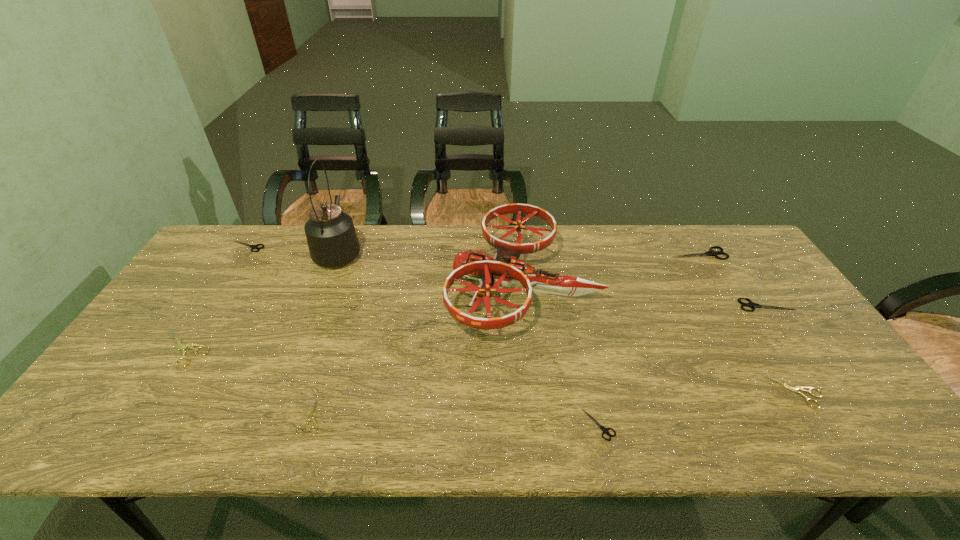
Find the location of `vacant space located on the left of the second smallest beige shears`. vacant space located on the left of the second smallest beige shears is located at coordinates (677, 392).

Where is `blank area located 0.290m on the right of the nearest black shears`? blank area located 0.290m on the right of the nearest black shears is located at coordinates (744, 424).

Where is `vacant region located on the left of the smallest beige shears`? The image size is (960, 540). vacant region located on the left of the smallest beige shears is located at coordinates (252, 417).

Where is `kettle that is at the far edge`? This screenshot has height=540, width=960. kettle that is at the far edge is located at coordinates (332, 240).

At what (x,y) coordinates should I click in order to perform the action: click on drone that is positioned at the far edge. Please return your answer as a coordinate pair (x, y). Looking at the image, I should click on (505, 268).

Identify the location of object that is at the far left corner. pos(251,246).

Identify the location of object that is at the far right corner. The height and width of the screenshot is (540, 960). (709, 253).

In order to click on vacant region at the far edge of the desktop in this screenshot , I will do `click(396, 232)`.

I want to click on vacant space at the near edge of the desktop, so click(x=629, y=441).

Find the location of a particular element. free region at the left edge is located at coordinates (181, 336).